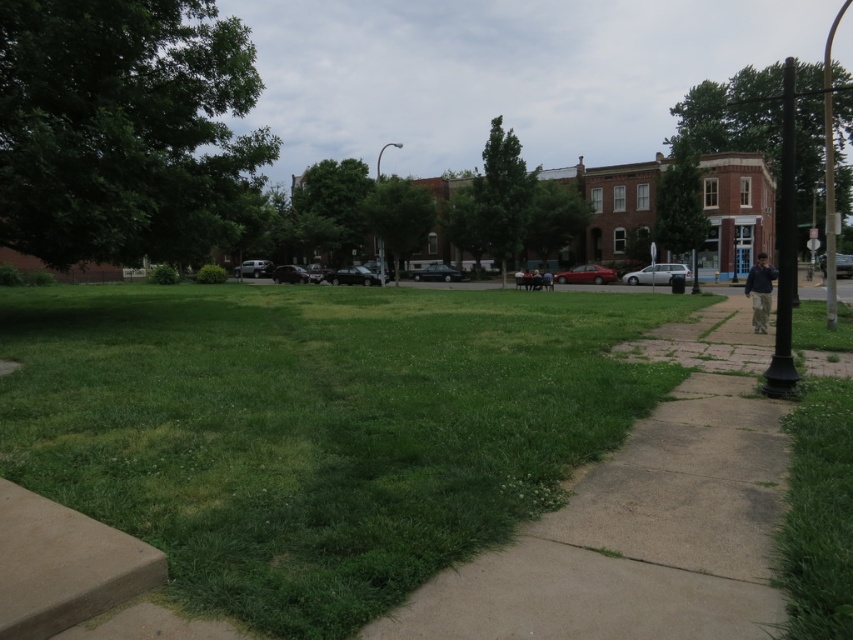
You are standing at the point marked as point (316, 428) in the image. Looking around, what do you see immediately below your feet?

The green grassy area at center is located at point (316, 428), so you would see the green grassy area at center immediately below your feet.

You are a pedestrian standing on the grassy area in the foreground of the park. You want to walk towards the street where the parked cars are. Which pole, the black metal pole at right or the metallic pole at center, will you encounter first?

The black metal pole at right is in front of the metallic pole at center, so you will encounter the black metal pole at right first.

You are a gardener planning to mow the green grassy area at center and trim the metallic pole at right. Which task requires more time considering their sizes?

The metallic pole at right is larger than the green grassy area at center, so trimming the metallic pole at right would take more time.